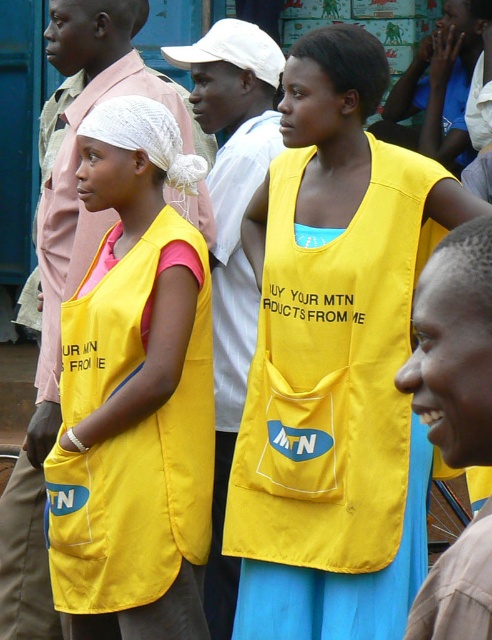
Question: Does yellow fabric vest at center appear on the right side of matte yellow vest at center?

Choices:
 (A) no
 (B) yes

Answer: (B)

Question: Is yellow fabric vest at center in front of matte yellow vest at center?

Choices:
 (A) no
 (B) yes

Answer: (B)

Question: Does yellow fabric vest at center have a lesser width compared to matte yellow vest at center?

Choices:
 (A) no
 (B) yes

Answer: (A)

Question: Which of the following is the farthest from the observer?

Choices:
 (A) yellow fabric vest at center
 (B) matte yellow vest at center

Answer: (B)